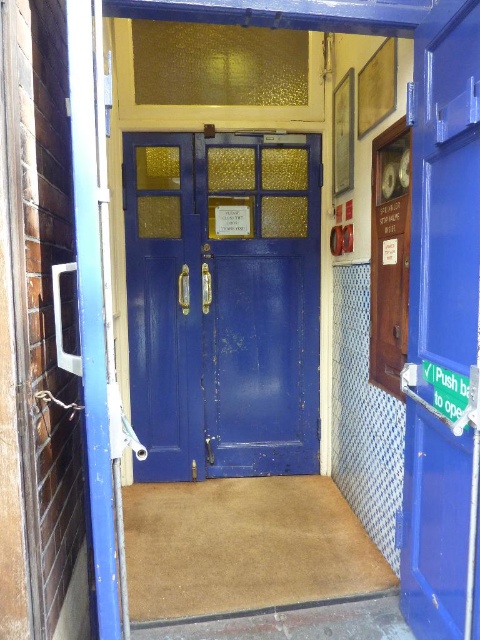
You are a delivery person with a 4.5 feet wide package. You need to move the package through the hallway to the doors. Can you fit the package between the matte blue door at center and the matte blue door at right?

The distance between the matte blue door at center and the matte blue door at right is 4.84 feet. Since the package is 4.5 feet wide, it can fit through the space between them as 4.5 is less than 4.84.

You are standing in the hallway facing the double doors. You need to exit through the doors. Which door should you open first, the matte blue door at center or the matte blue door at right?

The matte blue door at right is behind the matte blue door at center, so you should open the matte blue door at center first to exit through the doors.

You are a painter assigned to paint the matte blue door at center and the matte blue door at right. Which door requires a smaller amount of paint for its surface?

The matte blue door at center requires a smaller amount of paint because it has a lesser height compared to the matte blue door at right, resulting in a smaller surface area.